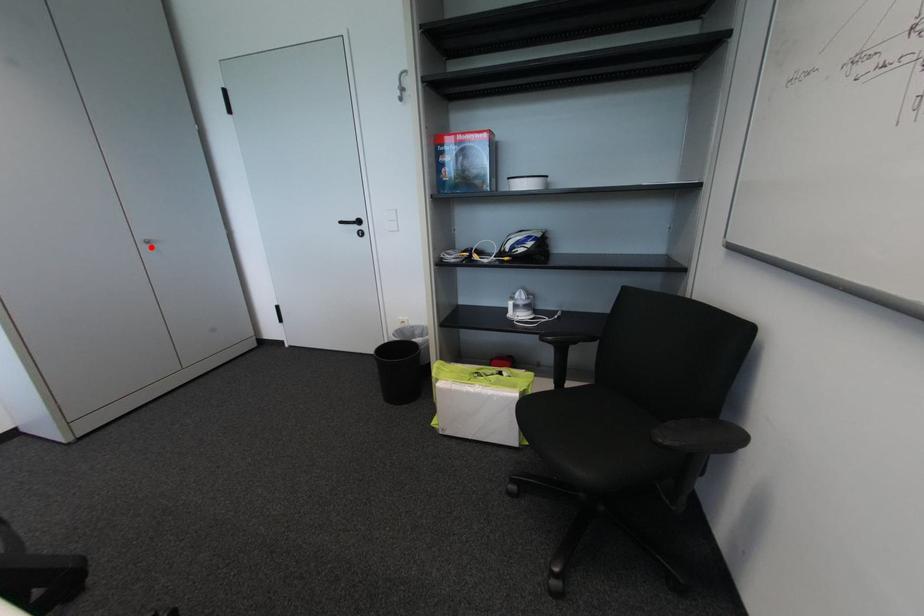
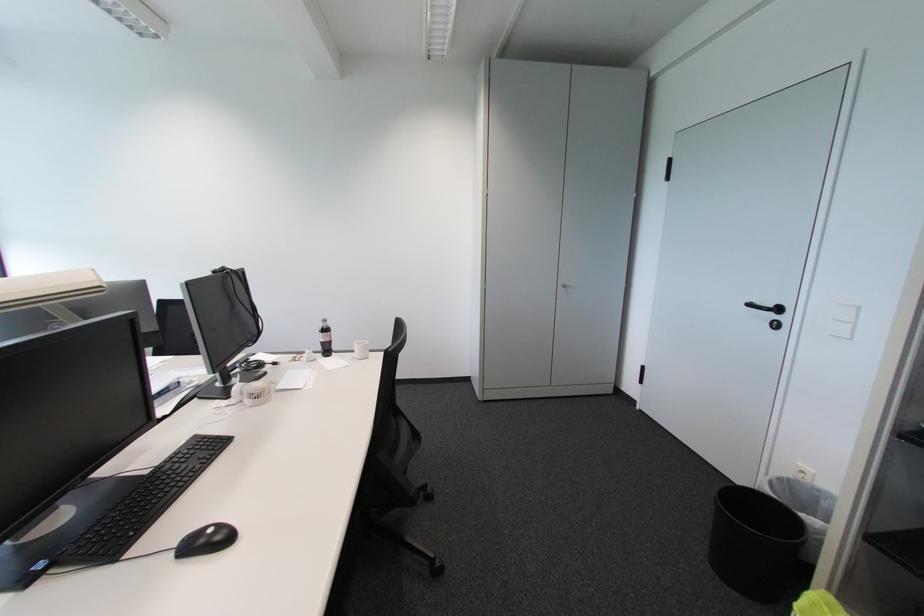
Find the pixel in the second image that matches the highlighted location in the first image.

(567, 290)